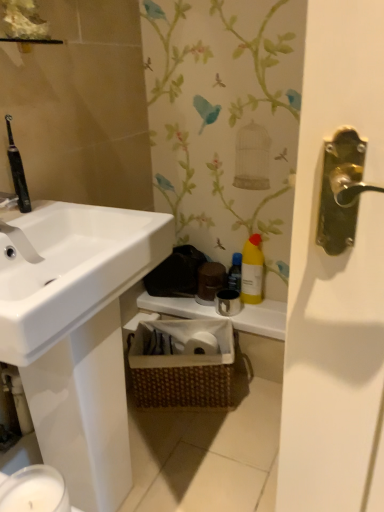
Where is `vacant space in front of yellow matte bottle at center`? This screenshot has width=384, height=512. vacant space in front of yellow matte bottle at center is located at coordinates (261, 313).